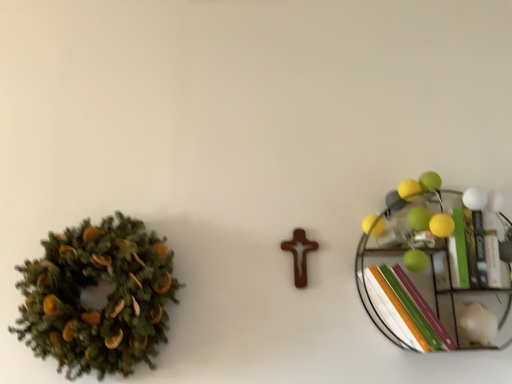
This screenshot has height=384, width=512. What do you see at coordinates (424, 271) in the screenshot? I see `metallic wire shelf at right` at bounding box center [424, 271].

Find the location of a particular element. green matte book at right is located at coordinates (472, 251).

The width and height of the screenshot is (512, 384). I want to click on green matte wreath at left, so click(x=104, y=303).

How many degrees apart are the facing directions of green matte wreath at left and green matte book at right?

They differ by 7.75e-05 degrees in their facing directions.

How far apart are green matte wreath at left and green matte book at right?

The distance of green matte wreath at left from green matte book at right is 91.92 centimeters.

Which of these two, green matte wreath at left or green matte book at right, is wider?

green matte book at right.

In the scene shown: Does green matte wreath at left lie behind green matte book at right?

No, the depth of green matte wreath at left is less than that of green matte book at right.

Can you tell me how much metallic wire shelf at right and green matte book at right differ in facing direction?

0.000624 degrees.

Considering the relative sizes of metallic wire shelf at right and green matte book at right in the image provided, is metallic wire shelf at right wider than green matte book at right?

In fact, metallic wire shelf at right might be narrower than green matte book at right.

Considering the relative positions of metallic wire shelf at right and green matte book at right in the image provided, is metallic wire shelf at right to the right of green matte book at right from the viewer's perspective?

No, metallic wire shelf at right is not to the right of green matte book at right.

Consider the image. Is metallic wire shelf at right positioned with its back to green matte book at right?

Absolutely, metallic wire shelf at right is directed away from green matte book at right.

Does green matte book at right have a greater height compared to metallic wire shelf at right?

In fact, green matte book at right may be shorter than metallic wire shelf at right.

From a real-world perspective, which is physically below, green matte book at right or metallic wire shelf at right?

From a 3D spatial view, metallic wire shelf at right is below.

Is green matte book at right at the left side of metallic wire shelf at right?

No, green matte book at right is not to the left of metallic wire shelf at right.

Which object is more forward, green matte book at right or metallic wire shelf at right?

metallic wire shelf at right is closer to the camera.

Between green matte wreath at left and metallic wire shelf at right, which one has more height?

Standing taller between the two is green matte wreath at left.

Between green matte wreath at left and metallic wire shelf at right, which one appears on the right side from the viewer's perspective?

From the viewer's perspective, metallic wire shelf at right appears more on the right side.

From a real-world perspective, who is located lower, green matte wreath at left or metallic wire shelf at right?

green matte wreath at left is physically lower.

Is point (134, 324) more distant than point (436, 262)?

No.

In terms of size, does metallic wire shelf at right appear bigger or smaller than green matte wreath at left?

Clearly, metallic wire shelf at right is smaller in size than green matte wreath at left.

Considering the sizes of metallic wire shelf at right and green matte wreath at left in the image, is metallic wire shelf at right wider or thinner than green matte wreath at left?

metallic wire shelf at right is thinner than green matte wreath at left.

Image resolution: width=512 pixels, height=384 pixels. Identify the location of shelf on the right of green matte wreath at left. (424, 271).

What's the angular difference between metallic wire shelf at right and green matte wreath at left's facing directions?

metallic wire shelf at right and green matte wreath at left are facing 0.000559 degrees away from each other.

How many degrees apart are the facing directions of green matte book at right and green matte wreath at left?

They differ by 7.75e-05 degrees in their facing directions.

Is green matte book at right facing away from green matte wreath at left?

green matte book at right does not have its back to green matte wreath at left.

Considering the relative sizes of green matte book at right and green matte wreath at left in the image provided, is green matte book at right bigger than green matte wreath at left?

No.

At what (x,y) coordinates should I click in order to perform the action: click on book on the right of the green matte wreath at left. Please return your answer as a coordinate pair (x, y). Image resolution: width=512 pixels, height=384 pixels. Looking at the image, I should click on (472, 251).

The height and width of the screenshot is (384, 512). What are the coordinates of `shelf below the green matte book at right (from a real-world perspective)` in the screenshot? It's located at (424, 271).

Based on their spatial positions, is green matte book at right or metallic wire shelf at right closer to green matte wreath at left?

Based on the image, metallic wire shelf at right appears to be nearer to green matte wreath at left.

Looking at the image, which one is located further to green matte book at right, metallic wire shelf at right or green matte wreath at left?

The object further to green matte book at right is green matte wreath at left.

Estimate the real-world distances between objects in this image. Which object is further from green matte wreath at left, metallic wire shelf at right or green matte book at right?

Based on the image, green matte book at right appears to be further to green matte wreath at left.

Which object lies nearer to the anchor point green matte book at right, green matte wreath at left or metallic wire shelf at right?

The object closer to green matte book at right is metallic wire shelf at right.

Considering their positions, is green matte book at right positioned further to metallic wire shelf at right than green matte wreath at left?

Based on the image, green matte wreath at left appears to be further to metallic wire shelf at right.

When comparing their distances from metallic wire shelf at right, does green matte wreath at left or green matte book at right seem further?

Based on the image, green matte wreath at left appears to be further to metallic wire shelf at right.

At what (x,y) coordinates should I click in order to perform the action: click on shelf located between green matte wreath at left and green matte book at right in the left-right direction. Please return your answer as a coordinate pair (x, y). Looking at the image, I should click on (424, 271).